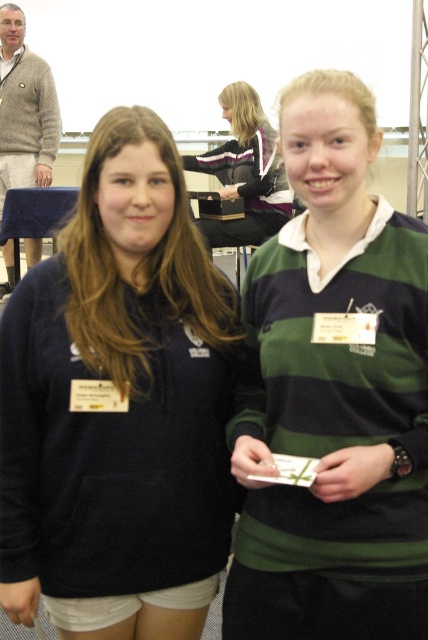
You are a photographer at the event and need to capture a clear photo of both the dark blue fleece at center and the green striped sweater at center. Based on their positions, which one is lower in the frame?

The dark blue fleece at center is located below the green striped sweater at center, so it is lower in the frame.